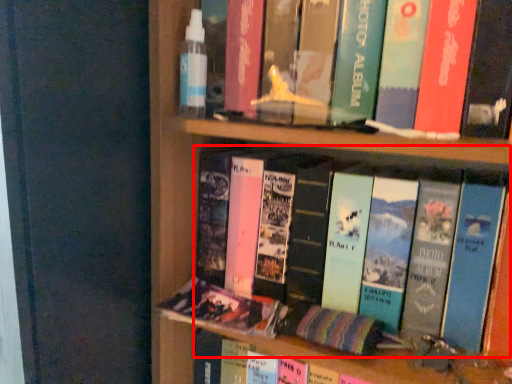
Question: From the image's perspective, considering the relative positions of book (annotated by the red box) and book in the image provided, where is book (annotated by the red box) located with respect to the staircase?

Choices:
 (A) above
 (B) below

Answer: (A)